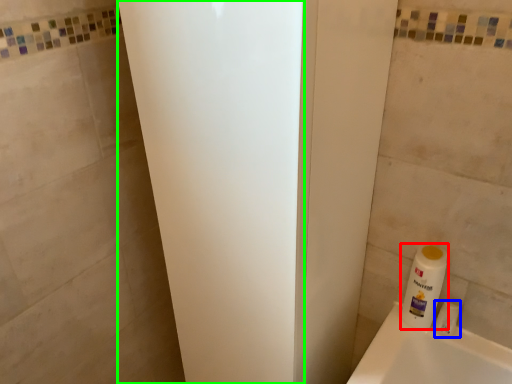
Question: Which object is positioned closest to cleaning product (highlighted by a red box)? Select from toiletry (highlighted by a blue box) and screen door (highlighted by a green box).

Choices:
 (A) toiletry
 (B) screen door

Answer: (A)